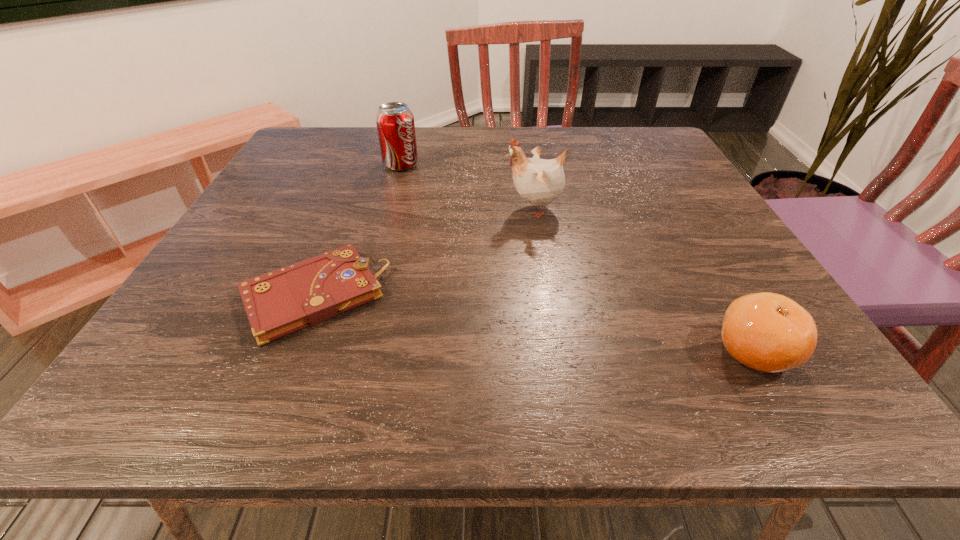
Identify the location of vacant area that lies between the clementine and the shortest object. The width and height of the screenshot is (960, 540). (x=533, y=323).

The image size is (960, 540). I want to click on free point between the shortest object and the bird, so click(x=423, y=252).

Where is `vacant region between the clementine and the soda can`? This screenshot has width=960, height=540. vacant region between the clementine and the soda can is located at coordinates coord(577,258).

You are a GUI agent. You are given a task and a screenshot of the screen. Output one action in this format:
    pyautogui.click(x=<x>, y=<y>)
    Task: Click on the object that ranks as the closest to the clementine
    
    Given the screenshot: What is the action you would take?
    pyautogui.click(x=539, y=181)

Locate which object is the third closest to the farthest object. Please provide its 2D coordinates. Your answer should be formatted as a tuple, i.e. [(x, y)], where the tuple contains the x and y coordinates of a point satisfying the conditions above.

[(768, 332)]

Locate an element on the screen. free space that satisfies the following two spatial constraints: 1. at the beak of the rightmost object; 2. on the right side of the second farthest object is located at coordinates (559, 352).

You are a GUI agent. You are given a task and a screenshot of the screen. Output one action in this format:
    pyautogui.click(x=<x>, y=<y>)
    Task: Click on the vacant area in the image that satisfies the following two spatial constraints: 1. at the beak of the third tallest object; 2. on the right side of the second object from right to left
    The height and width of the screenshot is (540, 960).
    Given the screenshot: What is the action you would take?
    coord(559,352)

Locate an element on the screen. vacant point that satisfies the following two spatial constraints: 1. on the front side of the clementine; 2. on the left side of the farthest object is located at coordinates (348, 352).